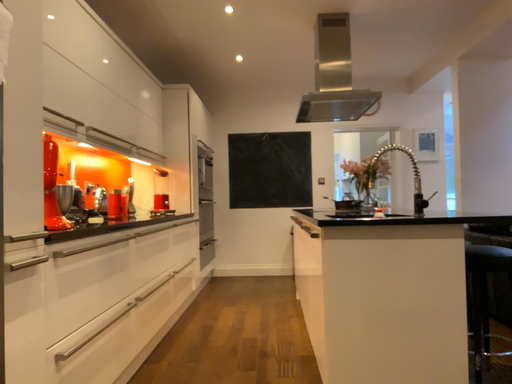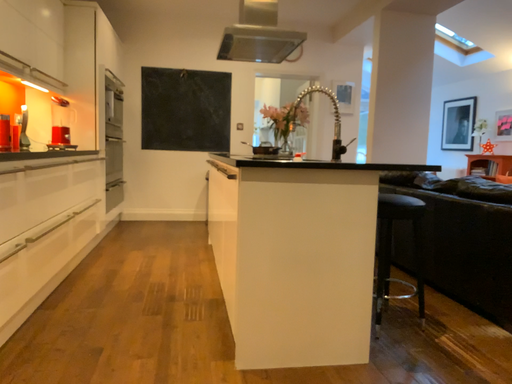
Question: How did the camera likely rotate when shooting the video?

Choices:
 (A) rotated downward
 (B) rotated upward

Answer: (A)